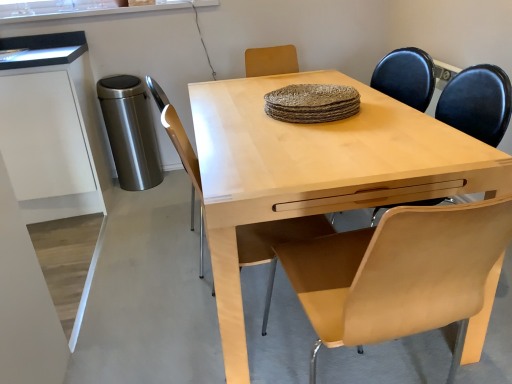
You are a GUI agent. You are given a task and a screenshot of the screen. Output one action in this format:
    pyautogui.click(x=<x>, y=<y>)
    Task: Click on the vacant space positioned to the left of light brown leather chair at center
    This screenshot has height=384, width=512.
    Given the screenshot: What is the action you would take?
    pyautogui.click(x=147, y=330)